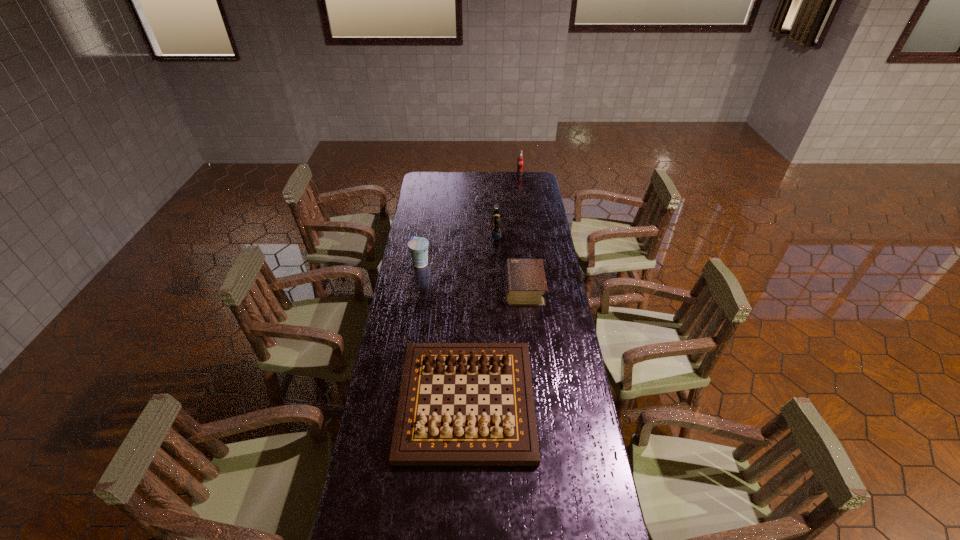
Identify the location of soda bottle. (520, 162).

This screenshot has height=540, width=960. I want to click on the second farthest object, so coord(495,220).

I want to click on yogurt, so click(418, 246).

Where is `gameboard`? The height and width of the screenshot is (540, 960). gameboard is located at coordinates (421, 438).

This screenshot has height=540, width=960. I want to click on the second nearest object, so click(x=525, y=280).

You are a GUI agent. You are given a task and a screenshot of the screen. Output one action in this format:
    pyautogui.click(x=<x>, y=<y>)
    Task: Click on the Bible
    The image size is (960, 540).
    Given the screenshot: What is the action you would take?
    pyautogui.click(x=525, y=280)

This screenshot has width=960, height=540. Find the location of `free location located 0.350m on the label of the farthest object`. free location located 0.350m on the label of the farthest object is located at coordinates (524, 207).

Identify the location of vacant space located on the ear cup of the second farthest object. This screenshot has height=540, width=960. (477, 233).

At what (x,y) coordinates should I click in order to perform the action: click on vacant space located 0.190m on the ear cup of the second farthest object. Please return your answer as a coordinate pair (x, y). The image size is (960, 540). Looking at the image, I should click on (453, 233).

The height and width of the screenshot is (540, 960). I want to click on free region located on the ear cup of the second farthest object, so click(430, 233).